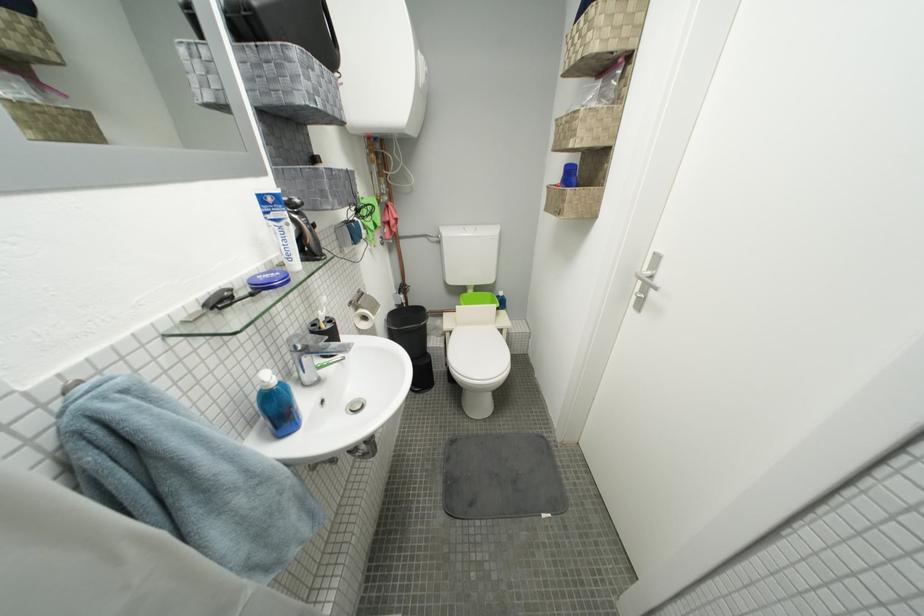
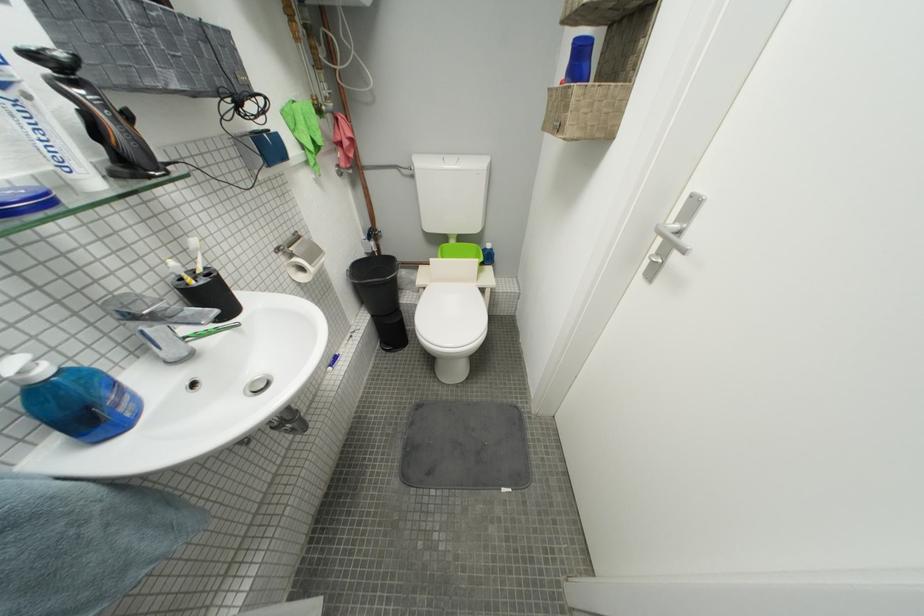
Where in the second image is the point corresponding to pixel 317 227 from the first image?

(114, 108)